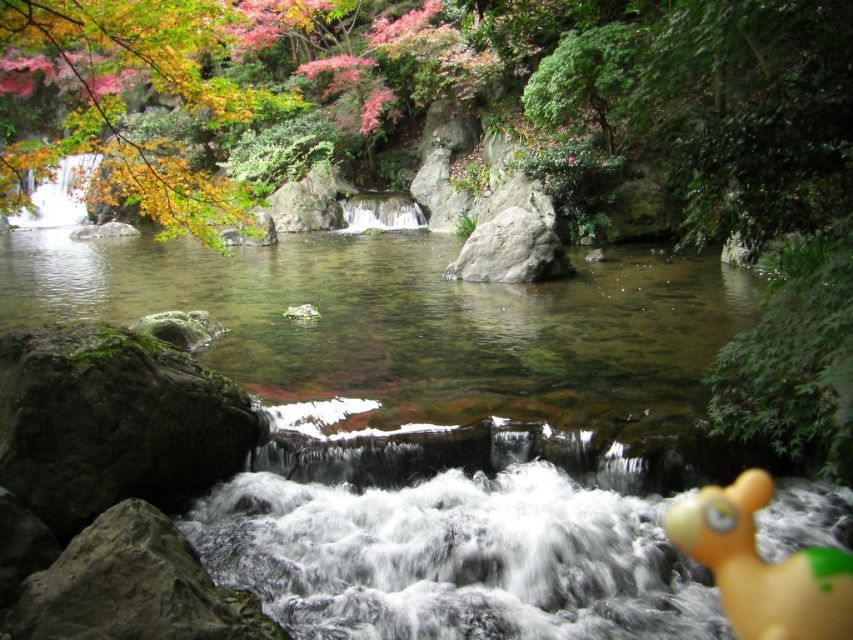
Between autumn leaves at upper left and yellow rubber duck at lower right, which one has less height?

With less height is yellow rubber duck at lower right.

Which is more to the left, autumn leaves at upper left or yellow rubber duck at lower right?

autumn leaves at upper left is more to the left.

Who is more distant from viewer, (103, 22) or (740, 608)?

Point (103, 22)

Locate an element on the screen. autumn leaves at upper left is located at coordinates (125, 102).

Does green mossy rock at lower left appear under yellow rubber duck at lower right?

No.

Does point (137, 460) lie in front of point (775, 632)?

No.

At what (x,y) coordinates should I click in order to perform the action: click on green mossy rock at lower left. Please return your answer as a coordinate pair (x, y). The width and height of the screenshot is (853, 640). Looking at the image, I should click on (112, 422).

Between autumn leaves at upper left and green mossy rock at lower left, which one appears on the left side from the viewer's perspective?

autumn leaves at upper left

Between point (1, 0) and point (59, 492), which one is positioned in front?

Point (59, 492)

Find the location of a particular element. autumn leaves at upper left is located at coordinates (125, 102).